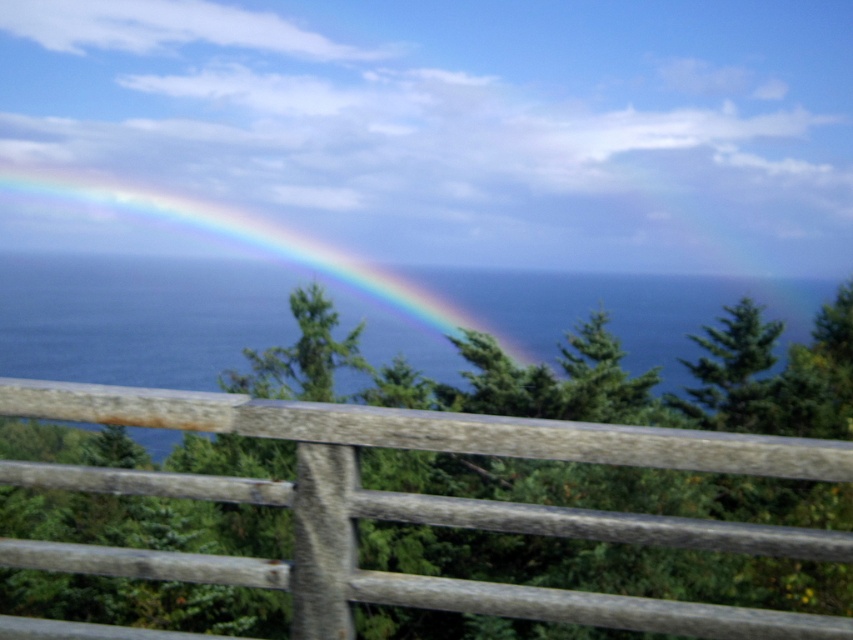
You are standing at the wooden railing and looking out at the scene. Which object, the blue water at center or the rainbow translucent at left, occupies more visual space in your view?

The blue water at center occupies more visual space in the view because it has a larger size compared to the rainbow translucent at left.

You are standing at the wooden railing and want to compare the widths of the blue water at center and the rainbow translucent at left. Which one do you think is wider?

The blue water at center is wider than the rainbow translucent at left according to the description.

You are standing in front of the scene and want to take a photo that includes both the weathered wood fence at center and the blue water at center. Which object will appear smaller in the photo?

The weathered wood fence at center will appear smaller in the photo because it has a smaller size compared to the blue water at center.